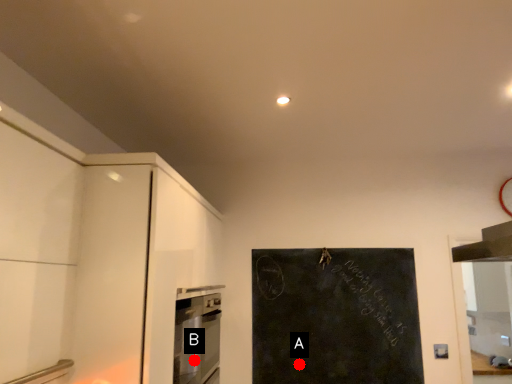
Question: Two points are circled on the image, labeled by A and B beside each circle. Among these points, which one is farthest from the camera?

Choices:
 (A) A is further
 (B) B is further

Answer: (A)